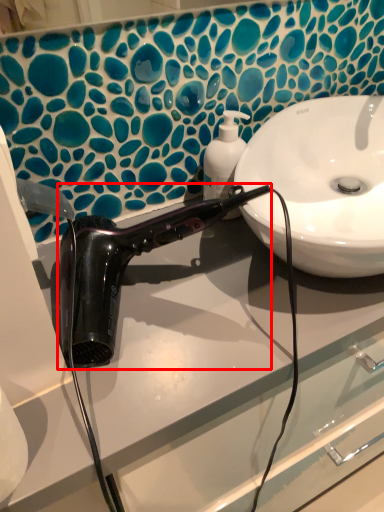
Question: Observing the image, what is the correct spatial positioning of hair dryer (annotated by the red box) in reference to soap dispenser?

Choices:
 (A) left
 (B) right

Answer: (A)